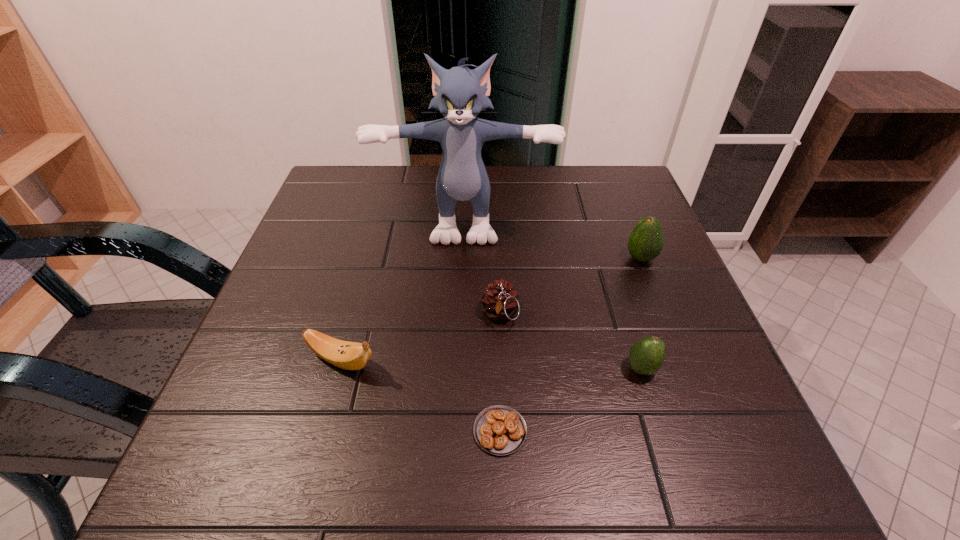
Where is `free location that satisfies the following two spatial constraints: 1. with a leaf charm attached to the pinecone; 2. on the right side of the fifth object from left to right`? Image resolution: width=960 pixels, height=540 pixels. free location that satisfies the following two spatial constraints: 1. with a leaf charm attached to the pinecone; 2. on the right side of the fifth object from left to right is located at coordinates (502, 368).

You are a GUI agent. You are given a task and a screenshot of the screen. Output one action in this format:
    pyautogui.click(x=<x>, y=<y>)
    Task: Click on the vacant area that satisfies the following two spatial constraints: 1. on the front-facing side of the shortest object; 2. on the left side of the tallest object
    The width and height of the screenshot is (960, 540).
    Given the screenshot: What is the action you would take?
    pyautogui.click(x=456, y=431)